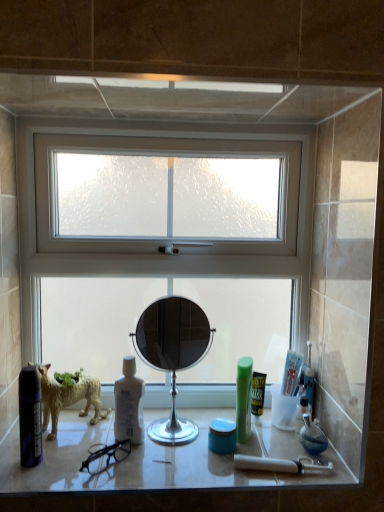
Find the location of a particular element. This screenshot has height=512, width=384. empty space that is to the right of matte black can at left is located at coordinates (97, 464).